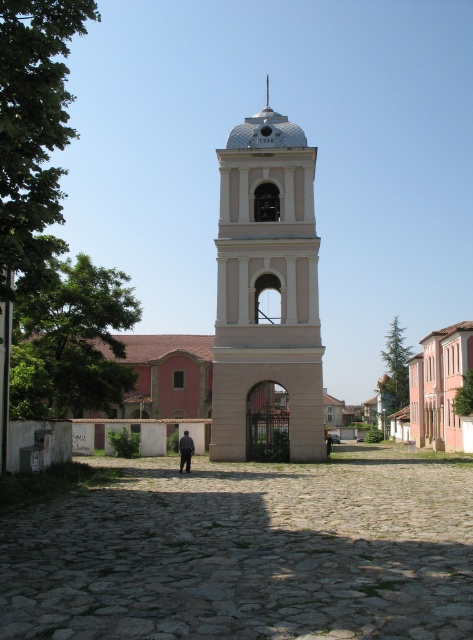
Does black fabric person at center come behind dark gray fabric at center?

No, it is not.

Between point (191, 442) and point (330, 442), which one is positioned behind?

Point (330, 442)

You are a GUI agent. You are given a task and a screenshot of the screen. Output one action in this format:
    pyautogui.click(x=<x>, y=<y>)
    Task: Click on the black fabric person at center
    This screenshot has height=640, width=473.
    Given the screenshot: What is the action you would take?
    pyautogui.click(x=185, y=451)

Does white smooth bell tower at center have a greater height compared to black fabric person at center?

Correct, white smooth bell tower at center is much taller as black fabric person at center.

You are a GUI agent. You are given a task and a screenshot of the screen. Output one action in this format:
    pyautogui.click(x=<x>, y=<y>)
    Task: Click on the white smooth bell tower at center
    
    Given the screenshot: What is the action you would take?
    pyautogui.click(x=266, y=284)

Who is positioned more to the left, white smooth bell tower at center or dark gray fabric at center?

white smooth bell tower at center

Is white smooth bell tower at center smaller than dark gray fabric at center?

No, white smooth bell tower at center is not smaller than dark gray fabric at center.

Who is more forward, [315,352] or [326,442]?

Point [315,352]

The image size is (473, 640). In order to click on white smooth bell tower at center in this screenshot , I will do `click(266, 284)`.